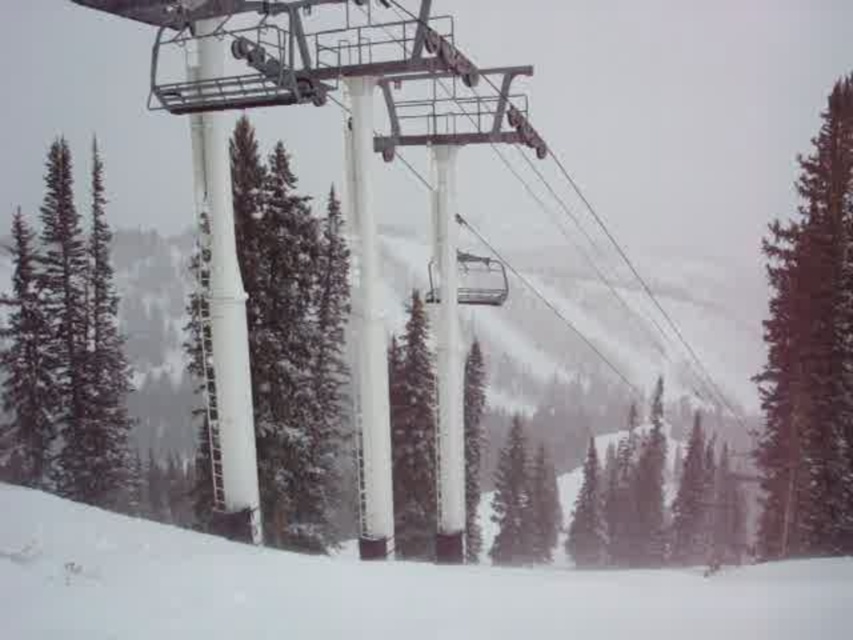
You are a photographer planning to take a photo of the white snow at lower center and the green matte tree at center. Which object should you focus on first if you want to capture both in the same frame without adjusting your camera settings?

The green matte tree at center is taller than the white snow at lower center, so focusing on the tree first would ensure both are in focus as the snow is shorter and within the same depth of field.

You are a photographer setting up equipment in the snowy mountain area. You need to place your tripod between the white matte pole at center and the green matte evergreen tree at left. Considering their sizes, which object should you position closer to for stability?

The white matte pole at center has a smaller size compared to the green matte evergreen tree at left, so positioning the tripod closer to the green matte evergreen tree at left would provide better stability due to its larger size.